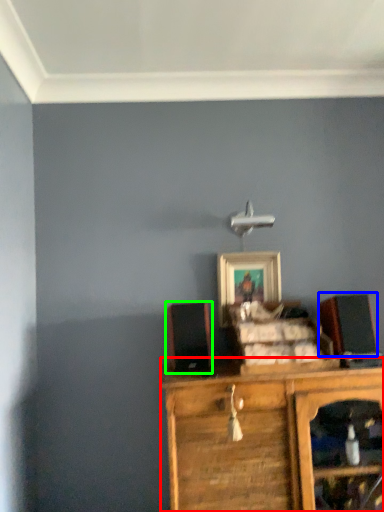
Question: Which object is the farthest from chest of drawers (highlighted by a red box)? Choose among these: speaker (highlighted by a blue box) or speaker (highlighted by a green box).

Choices:
 (A) speaker
 (B) speaker

Answer: (A)